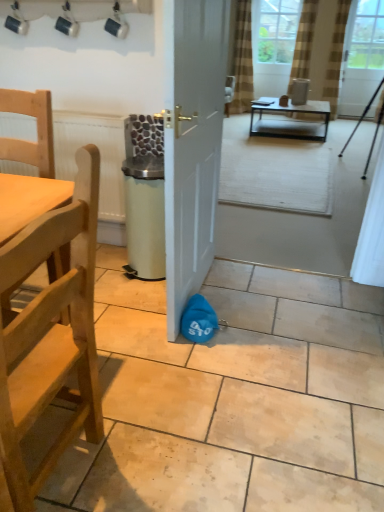
Question: Is brown striped curtain at upper center, which appears as the 1th curtain when viewed from the left, positioned in front of light wood/rough chair at left, which is the 2th chair in bottom-to-top order?

Choices:
 (A) yes
 (B) no

Answer: (B)

Question: Is brown striped curtain at upper center, which appears as the 1th curtain when viewed from the left, not within light wood/rough chair at left, which is the 2th chair in bottom-to-top order?

Choices:
 (A) yes
 (B) no

Answer: (A)

Question: Is brown striped curtain at upper center, arranged as the 3th curtain when viewed from the right, with light wood/rough chair at left, which is the 2th chair in bottom-to-top order?

Choices:
 (A) yes
 (B) no

Answer: (B)

Question: Does brown striped curtain at upper center, which appears as the 1th curtain when viewed from the left, have a smaller size compared to light wood/rough chair at left, which is the 2th chair in bottom-to-top order?

Choices:
 (A) no
 (B) yes

Answer: (A)

Question: Considering the relative sizes of brown striped curtain at upper center, arranged as the 3th curtain when viewed from the right, and light wood/rough chair at left, which is the 2th chair in bottom-to-top order, in the image provided, is brown striped curtain at upper center, arranged as the 3th curtain when viewed from the right, taller than light wood/rough chair at left, which is the 2th chair in bottom-to-top order,?

Choices:
 (A) no
 (B) yes

Answer: (B)

Question: From their relative heights in the image, would you say white glossy door at center is taller or shorter than brown textured curtain at upper right, which ranks as the 1th curtain in right-to-left order?

Choices:
 (A) tall
 (B) short

Answer: (B)

Question: Considering the relative positions of white glossy door at center and brown textured curtain at upper right, marked as the third curtain in a left-to-right arrangement, in the image provided, is white glossy door at center to the left or to the right of brown textured curtain at upper right, marked as the third curtain in a left-to-right arrangement,?

Choices:
 (A) left
 (B) right

Answer: (A)

Question: Is white glossy door at center inside or outside of brown textured curtain at upper right, which ranks as the 1th curtain in right-to-left order?

Choices:
 (A) outside
 (B) inside

Answer: (A)

Question: Considering the positions of white glossy door at center and brown textured curtain at upper right, which ranks as the 1th curtain in right-to-left order, in the image, is white glossy door at center bigger or smaller than brown textured curtain at upper right, which ranks as the 1th curtain in right-to-left order,?

Choices:
 (A) small
 (B) big

Answer: (B)

Question: Considering the positions of light wood/rough chair at left, which ranks as the first chair in top-to-bottom order, and white glossy door at center in the image, is light wood/rough chair at left, which ranks as the first chair in top-to-bottom order, bigger or smaller than white glossy door at center?

Choices:
 (A) big
 (B) small

Answer: (B)

Question: From the image's perspective, is light wood/rough chair at left, which ranks as the first chair in top-to-bottom order, positioned above or below white glossy door at center?

Choices:
 (A) above
 (B) below

Answer: (B)

Question: From a real-world perspective, is light wood/rough chair at left, which ranks as the first chair in top-to-bottom order, physically located above or below white glossy door at center?

Choices:
 (A) above
 (B) below

Answer: (A)

Question: Considering the positions of light wood/rough chair at left, which ranks as the first chair in top-to-bottom order, and white glossy door at center in the image, is light wood/rough chair at left, which ranks as the first chair in top-to-bottom order, wider or thinner than white glossy door at center?

Choices:
 (A) thin
 (B) wide

Answer: (B)

Question: Is white glossy door at center to the left or to the right of wooden chair at left, placed as the first chair when sorted from bottom to top, in the image?

Choices:
 (A) left
 (B) right

Answer: (B)

Question: Considering their positions, is white glossy door at center located in front of or behind wooden chair at left, placed as the first chair when sorted from bottom to top?

Choices:
 (A) behind
 (B) front

Answer: (A)